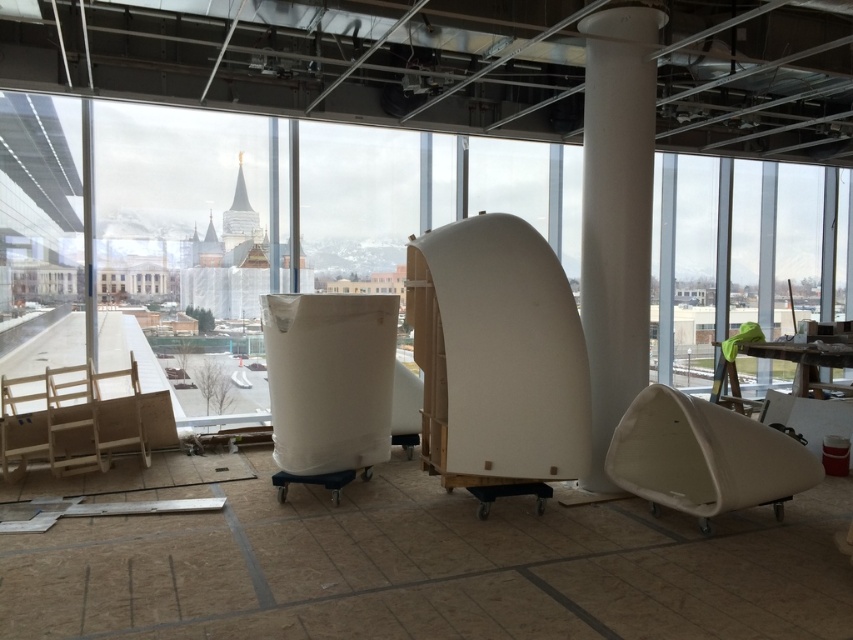
Who is shorter, white smooth column at center or white matte chair at lower right?

white matte chair at lower right is shorter.

Who is more distant from viewer, [583,326] or [717,497]?

Point [583,326]

Image resolution: width=853 pixels, height=640 pixels. I want to click on white smooth column at center, so click(x=616, y=211).

Find the location of a particular element. Image resolution: width=853 pixels, height=640 pixels. white smooth column at center is located at coordinates (616, 211).

Which is more to the left, white smooth column at center or wooden chair at left?

Positioned to the left is wooden chair at left.

Is point (602, 397) more distant than point (119, 378)?

No.

The height and width of the screenshot is (640, 853). In order to click on white smooth column at center in this screenshot , I will do `click(616, 211)`.

Describe the element at coordinates (22, 422) in the screenshot. Image resolution: width=853 pixels, height=640 pixels. I see `wooden chair at lower left` at that location.

Who is shorter, wooden chair at lower left or wooden chair at left?

wooden chair at lower left is shorter.

At what (x,y) coordinates should I click in order to perform the action: click on wooden chair at lower left. Please return your answer as a coordinate pair (x, y). The image size is (853, 640). Looking at the image, I should click on (22, 422).